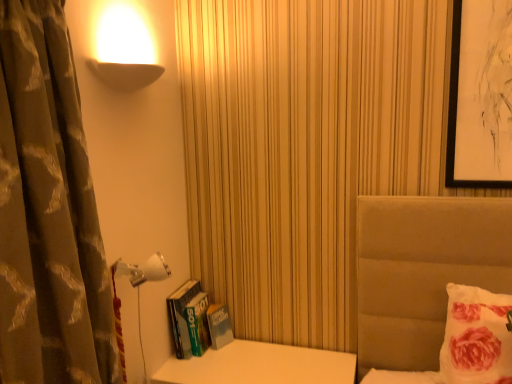
Question: Is white plastic lamp at lower left next to brown textured curtain at left and touching it?

Choices:
 (A) no
 (B) yes

Answer: (A)

Question: Is white plastic lamp at lower left at the right side of brown textured curtain at left?

Choices:
 (A) yes
 (B) no

Answer: (A)

Question: Does white plastic lamp at lower left lie behind brown textured curtain at left?

Choices:
 (A) yes
 (B) no

Answer: (A)

Question: Considering the relative sizes of white plastic lamp at lower left and brown textured curtain at left in the image provided, is white plastic lamp at lower left shorter than brown textured curtain at left?

Choices:
 (A) yes
 (B) no

Answer: (A)

Question: From a real-world perspective, is white plastic lamp at lower left on brown textured curtain at left?

Choices:
 (A) no
 (B) yes

Answer: (A)

Question: Is brown textured curtain at left surrounded by white plastic lamp at lower left?

Choices:
 (A) no
 (B) yes

Answer: (A)

Question: Is fluffy white pillow at right smaller than white glossy table at lower left?

Choices:
 (A) no
 (B) yes

Answer: (B)

Question: Can you confirm if fluffy white pillow at right is wider than white glossy table at lower left?

Choices:
 (A) yes
 (B) no

Answer: (B)

Question: From the image's perspective, is fluffy white pillow at right below white glossy table at lower left?

Choices:
 (A) yes
 (B) no

Answer: (B)

Question: From a real-world perspective, is fluffy white pillow at right under white glossy table at lower left?

Choices:
 (A) no
 (B) yes

Answer: (A)

Question: Can you confirm if fluffy white pillow at right is positioned to the left of white glossy table at lower left?

Choices:
 (A) yes
 (B) no

Answer: (B)

Question: Can you confirm if fluffy white pillow at right is thinner than white glossy table at lower left?

Choices:
 (A) no
 (B) yes

Answer: (B)

Question: Is hardcover book at left next to white plastic lamp at lower left and touching it?

Choices:
 (A) yes
 (B) no

Answer: (B)